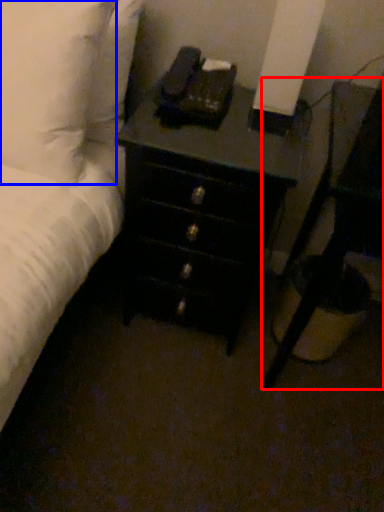
Question: Which point is closer to the camera, nightstand (highlighted by a red box) or pillow (highlighted by a blue box)?

Choices:
 (A) nightstand
 (B) pillow

Answer: (A)